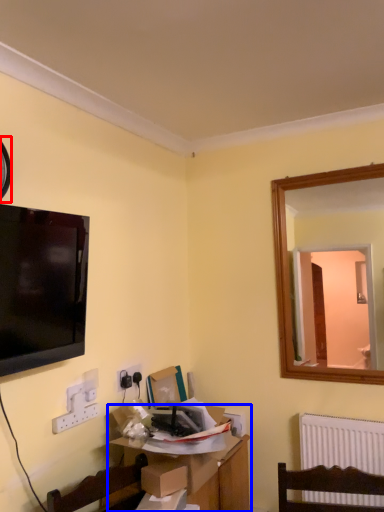
Question: Which object is closer to the camera taking this photo, clock (highlighted by a red box) or table (highlighted by a blue box)?

Choices:
 (A) clock
 (B) table

Answer: (A)